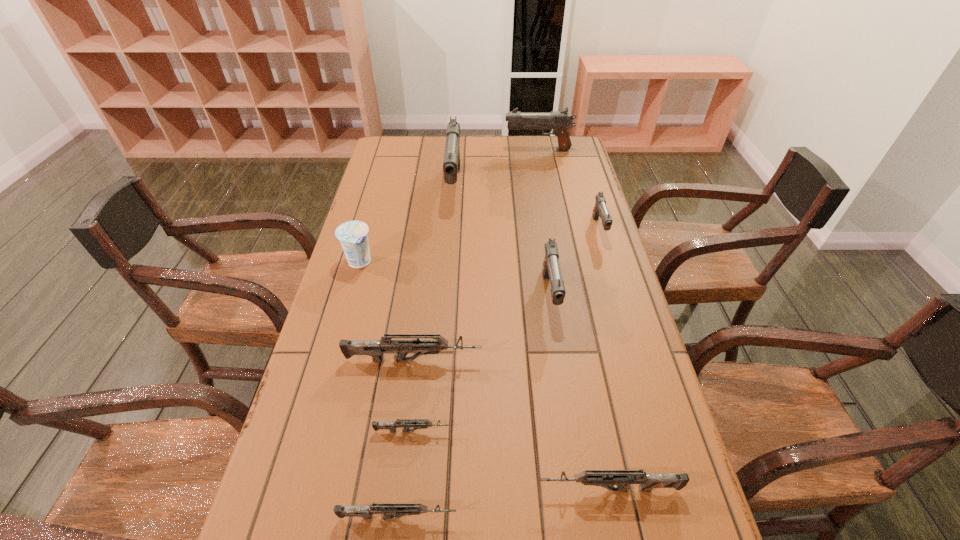
This screenshot has width=960, height=540. I want to click on free spot between the fifth nearest gun and the shortest gun, so click(x=481, y=363).

In order to click on free space between the sixth tallest gun and the biggest gray gun in this screenshot , I will do `click(532, 338)`.

Locate an element on the screen. vacant point located between the third biggest gray gun and the fourth nearest object is located at coordinates (482, 328).

What are the coordinates of `unoccupied position between the farthest gray gun and the yogurt` in the screenshot? It's located at point(448,206).

The height and width of the screenshot is (540, 960). In order to click on free spot between the seventh shortest gun and the shortest gun in this screenshot , I will do `click(475, 291)`.

Identify the location of free space between the seventh farthest object and the fifth nearest gun. (481, 363).

At what (x,y) coordinates should I click in order to perform the action: click on free space between the third farthest gray gun and the second tallest object. Please return your answer as a coordinate pair (x, y). This screenshot has width=960, height=540. Looking at the image, I should click on (568, 189).

Locate an element on the screen. The width and height of the screenshot is (960, 540). object that is the seventh nearest to the seventh shortest object is located at coordinates (388, 510).

Choose which object is the eighth nearest neighbor to the second tallest object. Please provide its 2D coordinates. Your answer should be formatted as a tuple, i.e. [(x, y)], where the tuple contains the x and y coordinates of a point satisfying the conditions above.

[(388, 510)]

This screenshot has width=960, height=540. I want to click on gun object that ranks as the closest to the seventh nearest object, so tap(551, 269).